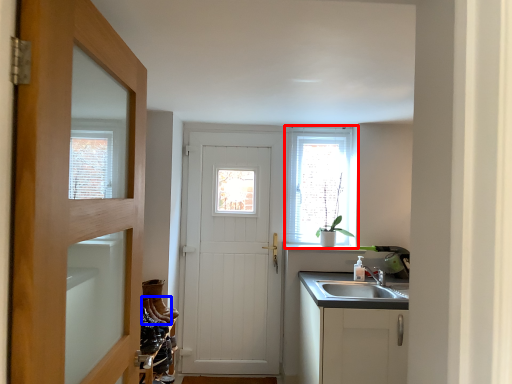
Question: Which object appears closest to the camera in this image, window (highlighted by a red box) or shoe (highlighted by a blue box)?

Choices:
 (A) window
 (B) shoe

Answer: (B)